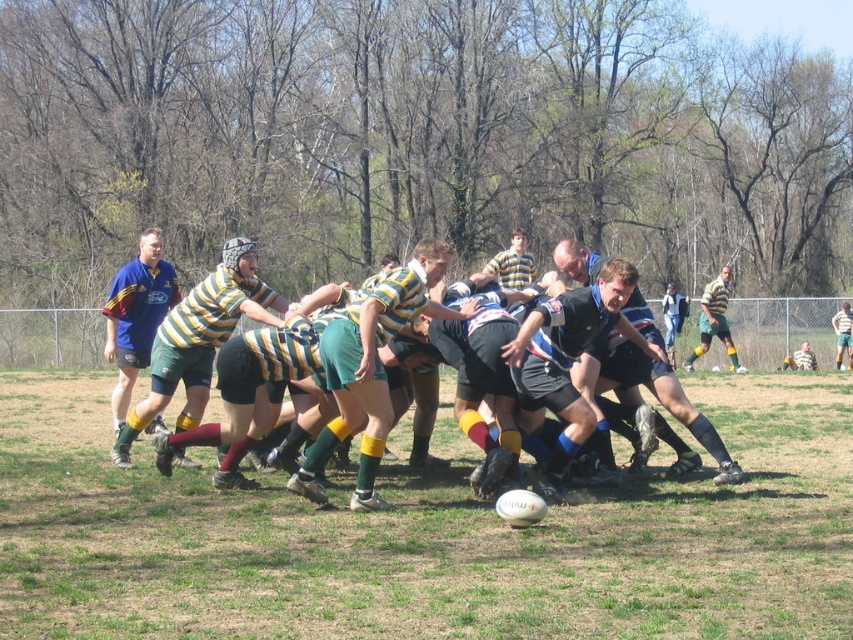
Can you confirm if green striped jersey at center is bigger than matte green shorts at center?

No.

Identify the location of green striped jersey at center. Image resolution: width=853 pixels, height=640 pixels. (369, 369).

Is green grass at center in front of matte green shorts at center?

Yes.

Does green grass at center appear over matte green shorts at center?

Actually, green grass at center is below matte green shorts at center.

Which is behind, point (207, 595) or point (177, 305)?

The point (177, 305) is more distant.

The image size is (853, 640). Identify the location of green grass at center. (426, 538).

Does green striped jersey at center lie behind yellow-green striped jersey at center?

That is False.

Between point (364, 451) and point (717, 278), which one is positioned in front?

Positioned in front is point (364, 451).

You are a GUI agent. You are given a task and a screenshot of the screen. Output one action in this format:
    pyautogui.click(x=<x>, y=<y>)
    Task: Click on the green striped jersey at center
    
    Given the screenshot: What is the action you would take?
    pyautogui.click(x=369, y=369)